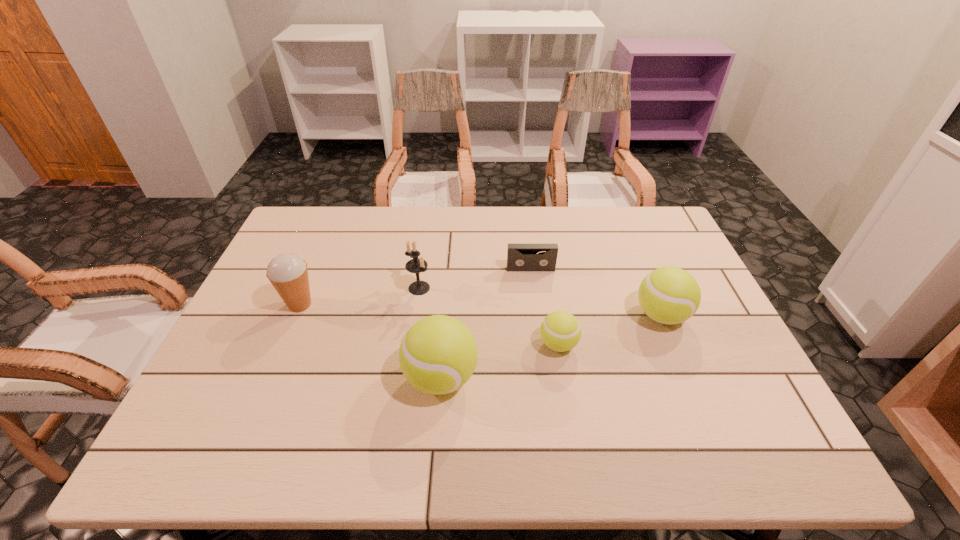
What are the coordinates of `free point between the leftmost tennis ball and the shortest tennis ball` in the screenshot? It's located at (499, 361).

Locate an element on the screen. vacant space that is in between the leftmost object and the second tallest tennis ball is located at coordinates (481, 310).

At what (x,y) coordinates should I click in order to perform the action: click on free space between the second tallest tennis ball and the leftmost object. Please return your answer as a coordinate pair (x, y). The height and width of the screenshot is (540, 960). Looking at the image, I should click on (481, 310).

Where is `free spot between the farthest object and the rightmost tennis ball`? The height and width of the screenshot is (540, 960). free spot between the farthest object and the rightmost tennis ball is located at coordinates (596, 292).

Image resolution: width=960 pixels, height=540 pixels. What are the coordinates of `empty space between the shortest tennis ball and the rightmost tennis ball` in the screenshot? It's located at (610, 330).

Where is `blank region between the icecream and the leftmost tennis ball`? The image size is (960, 540). blank region between the icecream and the leftmost tennis ball is located at coordinates (371, 341).

Locate an element on the screen. The width and height of the screenshot is (960, 540). object that is the second nearest to the candle holder is located at coordinates (520, 257).

The height and width of the screenshot is (540, 960). In order to click on object that is the nearest to the candle holder in this screenshot , I will do `click(438, 354)`.

Identify which tennis ball is the closest to the rightmost tennis ball. Please provide its 2D coordinates. Your answer should be formatted as a tuple, i.e. [(x, y)], where the tuple contains the x and y coordinates of a point satisfying the conditions above.

[(560, 331)]

You are a GUI agent. You are given a task and a screenshot of the screen. Output one action in this format:
    pyautogui.click(x=<x>, y=<y>)
    Task: Click on the second closest tennis ball to the candle holder
    
    Given the screenshot: What is the action you would take?
    pyautogui.click(x=560, y=331)